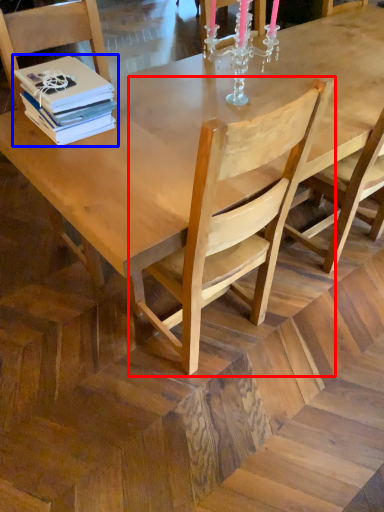
Question: Which object is closer to the camera taking this photo, chair (highlighted by a red box) or book (highlighted by a blue box)?

Choices:
 (A) chair
 (B) book

Answer: (A)